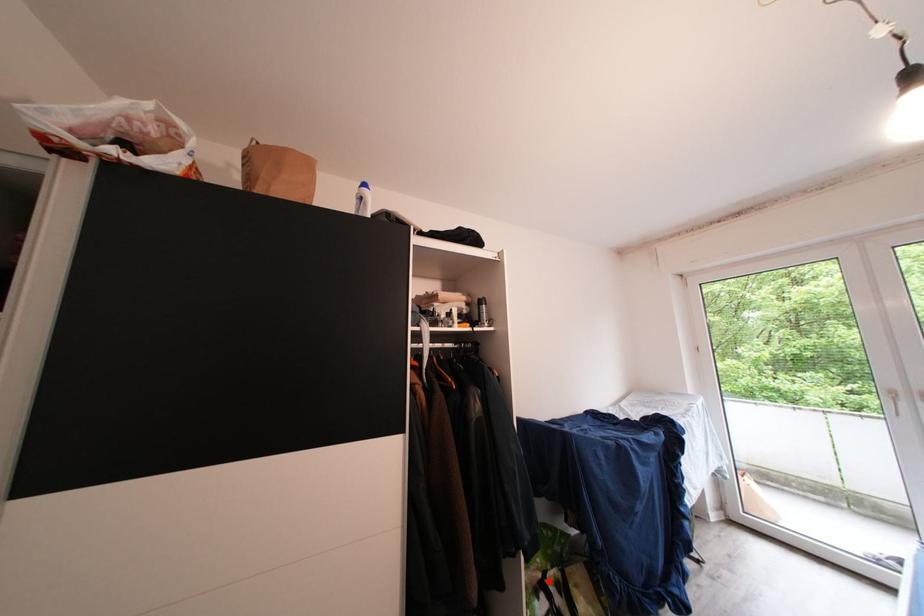
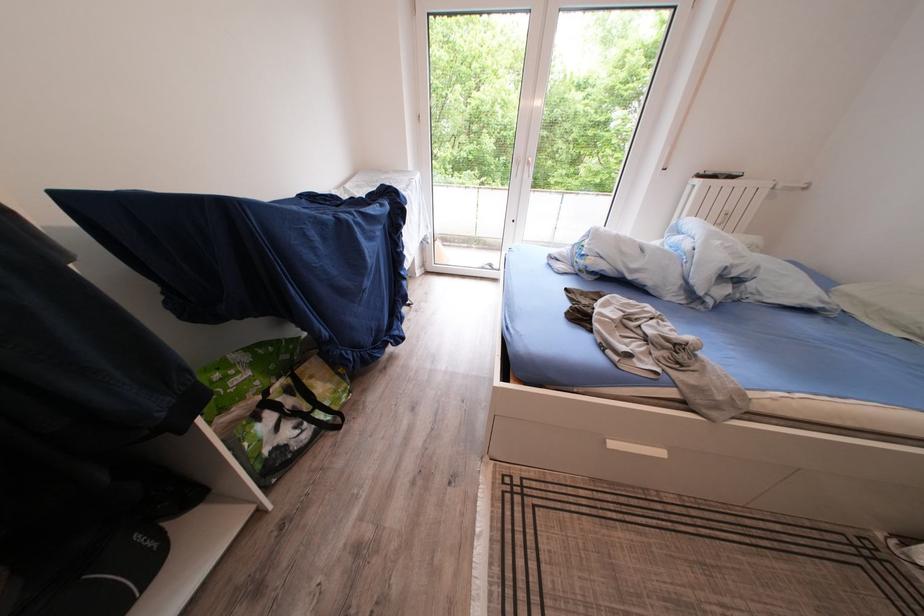
In the second image, find the point that corresponds to the highlighted location in the first image.

(268, 403)